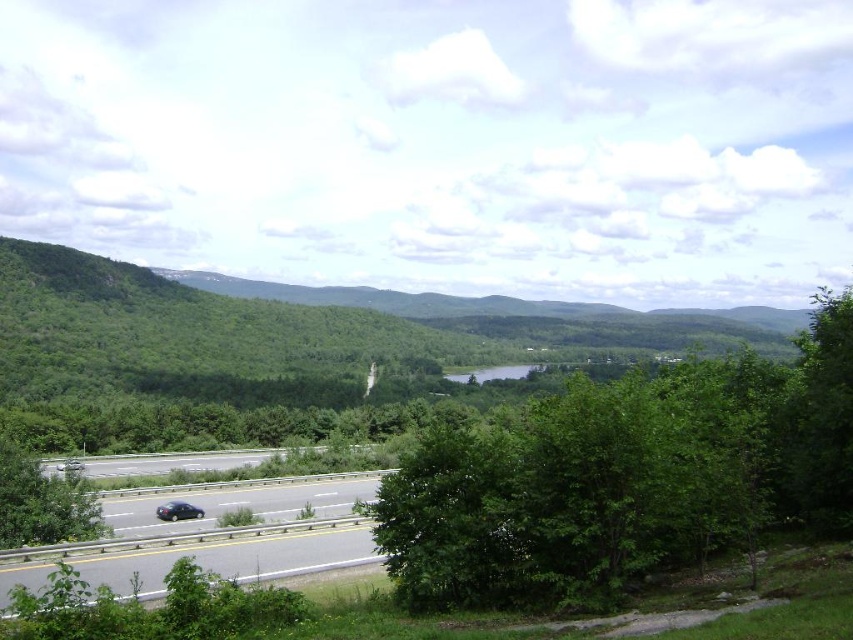
You are a pedestrian standing at the edge of the multi lane highway with guardrail. You see the shiny black sedan at lower left approaching you. There is a green leafy tree at center nearby. Can you safely reach the tree before the car arrives?

The green leafy tree at center is 42.38 meters away from the shiny black sedan at lower left. Since the car is approaching, but the distance is significant, you can safely reach the tree before the car arrives.

You are driving a car and see the image ahead. There is a shiny black sedan at lower left and a green leafy tree at center. Which object is closer to the right edge of the road?

The green leafy tree at center is positioned on the right side of the shiny black sedan at lower left, so the green leafy tree at center is closer to the right edge of the road.

You are a pedestrian standing on the side of the road near the guardrail. You see the green leafy tree at center and the shiny black sedan at lower left. Which object is closer to you?

The green leafy tree at center is closer to you than the shiny black sedan at lower left.